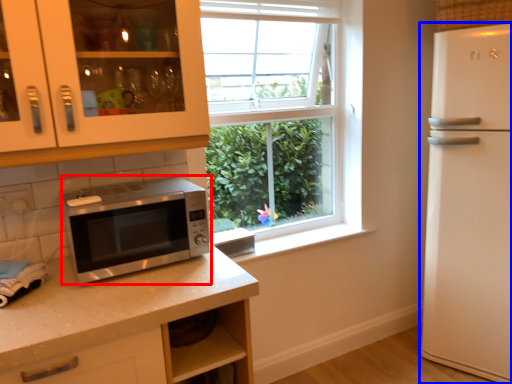
Question: Which of the following is the closest to the observer, microwave oven (highlighted by a red box) or refrigerator (highlighted by a blue box)?

Choices:
 (A) microwave oven
 (B) refrigerator

Answer: (A)